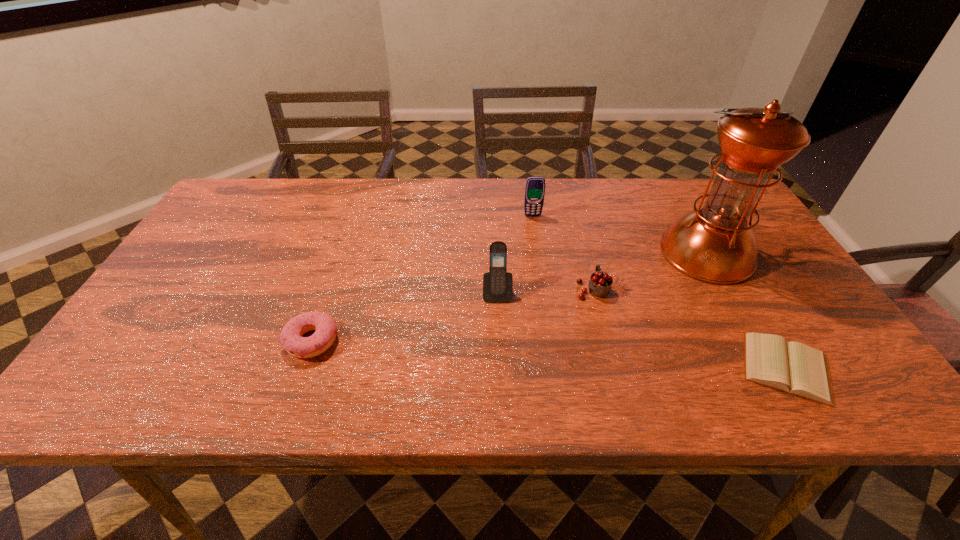
The width and height of the screenshot is (960, 540). I want to click on oil lamp situated at the right edge, so click(x=715, y=243).

Where is `diary located in the right edge section of the desktop`? The height and width of the screenshot is (540, 960). diary located in the right edge section of the desktop is located at coordinates tap(795, 368).

Find the location of `object that is at the near right corner`. object that is at the near right corner is located at coordinates (795, 368).

Identify the location of blank space at the far edge of the desktop. The image size is (960, 540). (621, 195).

The image size is (960, 540). In the image, there is a desktop. What are the coordinates of `free space at the near edge` in the screenshot? It's located at (231, 388).

In the image, there is a desktop. At what (x,y) coordinates should I click in order to perform the action: click on free space at the right edge. Please return your answer as a coordinate pair (x, y). The height and width of the screenshot is (540, 960). Looking at the image, I should click on (777, 330).

Identify the location of vacant area at the far left corner. (214, 212).

I want to click on unoccupied position between the oil lamp and the cherry, so click(649, 271).

Locate an element on the screen. Image resolution: width=960 pixels, height=540 pixels. free space between the fifth object from right to left and the doughnut is located at coordinates (404, 316).

The height and width of the screenshot is (540, 960). In order to click on free space that is in between the doughnut and the third object from right to left in this screenshot , I will do `click(452, 315)`.